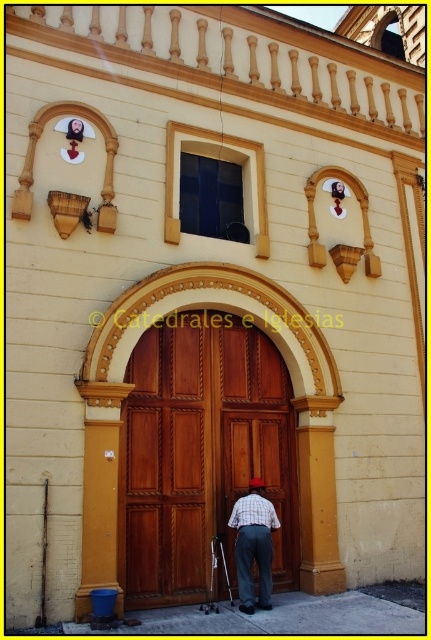
Question: Which point appears farthest from the camera in this image?

Choices:
 (A) (222, 531)
 (B) (293, 525)
 (C) (237, 518)

Answer: (B)

Question: Among these objects, which one is farthest from the camera?

Choices:
 (A) wooden door at center
 (B) wooden at center
 (C) plaid fabric pants at center

Answer: (B)

Question: Which of these objects is positioned closest to the wooden at center?

Choices:
 (A) wooden door at center
 (B) plaid fabric pants at center

Answer: (B)

Question: Does wooden door at center have a larger size compared to plaid fabric pants at center?

Choices:
 (A) yes
 (B) no

Answer: (B)

Question: Does wooden door at center lie in front of plaid fabric pants at center?

Choices:
 (A) yes
 (B) no

Answer: (B)

Question: Can you confirm if wooden door at center is positioned to the left of plaid fabric pants at center?

Choices:
 (A) no
 (B) yes

Answer: (B)